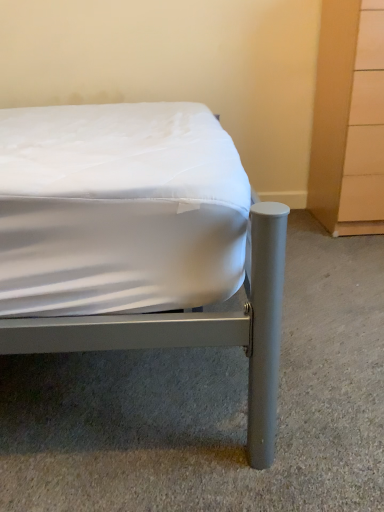
Based on the photo, measure the distance between point (236, 317) and camera.

A distance of 74.80 centimeters exists between point (236, 317) and camera.

The height and width of the screenshot is (512, 384). In order to click on metallic gray bed at center in this screenshot , I will do `click(138, 241)`.

The width and height of the screenshot is (384, 512). What do you see at coordinates (138, 241) in the screenshot?
I see `metallic gray bed at center` at bounding box center [138, 241].

Where is `light wood dresser at right`? This screenshot has width=384, height=512. light wood dresser at right is located at coordinates (349, 119).

What do you see at coordinates (349, 119) in the screenshot?
I see `light wood dresser at right` at bounding box center [349, 119].

In order to face light wood dresser at right, should I rotate leftwards or rightwards?

To face it directly, rotate right by 23.253 degrees.

What is the approximate height of light wood dresser at right?

35.45 inches.

Locate an element on the screen. metallic gray bed at center is located at coordinates (138, 241).

Visually, is light wood dresser at right positioned to the left or to the right of metallic gray bed at center?

In the image, light wood dresser at right appears on the right side of metallic gray bed at center.

Relative to metallic gray bed at center, is light wood dresser at right in front or behind?

Visually, light wood dresser at right is located behind metallic gray bed at center.

Does point (383, 46) appear closer or farther from the camera than point (12, 322)?

Point (383, 46) appears to be farther away from the viewer than point (12, 322).

From the image's perspective, which one is positioned lower, light wood dresser at right or metallic gray bed at center?

metallic gray bed at center.

From a real-world perspective, is light wood dresser at right under metallic gray bed at center?

Yes.

In terms of width, does light wood dresser at right look wider or thinner when compared to metallic gray bed at center?

In the image, light wood dresser at right appears to be more narrow than metallic gray bed at center.

Is light wood dresser at right taller than metallic gray bed at center?

Indeed, light wood dresser at right has a greater height compared to metallic gray bed at center.

Looking at the image, does light wood dresser at right seem bigger or smaller compared to metallic gray bed at center?

In the image, light wood dresser at right appears to be smaller than metallic gray bed at center.

Would you say metallic gray bed at center is part of light wood dresser at right's contents?

No, metallic gray bed at center is not a part of light wood dresser at right.

Are light wood dresser at right and metallic gray bed at center located far from each other?

No, light wood dresser at right is in close proximity to metallic gray bed at center.

Is light wood dresser at right turned away from metallic gray bed at center?

light wood dresser at right is not turned away from metallic gray bed at center.

How much distance is there between light wood dresser at right and metallic gray bed at center?

light wood dresser at right and metallic gray bed at center are 39.08 inches apart.

This screenshot has width=384, height=512. What are the coordinates of `dresser beneath the metallic gray bed at center (from a real-world perspective)` in the screenshot? It's located at (349, 119).

Considering the relative positions of metallic gray bed at center and light wood dresser at right in the image provided, is metallic gray bed at center to the left or to the right of light wood dresser at right?

Based on their positions, metallic gray bed at center is located to the left of light wood dresser at right.

Does metallic gray bed at center come behind light wood dresser at right?

No, it is in front of light wood dresser at right.

Considering the points (48, 257) and (375, 216), which point is behind, point (48, 257) or point (375, 216)?

The point (375, 216) is more distant.

From the image's perspective, is metallic gray bed at center located above or below light wood dresser at right?

Clearly, from the image's perspective, metallic gray bed at center is below light wood dresser at right.

From a real-world perspective, which object rests below the other?

light wood dresser at right, from a real-world perspective.

Which of these two, metallic gray bed at center or light wood dresser at right, is wider?

With larger width is metallic gray bed at center.

Considering the sizes of objects metallic gray bed at center and light wood dresser at right in the image provided, who is taller, metallic gray bed at center or light wood dresser at right?

light wood dresser at right is taller.

Is metallic gray bed at center bigger than light wood dresser at right?

Indeed, metallic gray bed at center has a larger size compared to light wood dresser at right.

Can light wood dresser at right be found inside metallic gray bed at center?

No, light wood dresser at right is not inside metallic gray bed at center.

Consider the image. Are metallic gray bed at center and light wood dresser at right far apart?

No.

Is metallic gray bed at center oriented towards light wood dresser at right?

Yes, metallic gray bed at center faces towards light wood dresser at right.

Looking at this image, how different are the orientations of metallic gray bed at center and light wood dresser at right in degrees?

The angle between the facing direction of metallic gray bed at center and the facing direction of light wood dresser at right is 90.5 degrees.

What are the coordinates of `bed on the left side of light wood dresser at right` in the screenshot? It's located at (138, 241).

Locate an element on the screen. This screenshot has height=512, width=384. bed below the light wood dresser at right (from the image's perspective) is located at coordinates (138, 241).

Where is `bed above the light wood dresser at right (from a real-world perspective)`? This screenshot has height=512, width=384. bed above the light wood dresser at right (from a real-world perspective) is located at coordinates (138, 241).